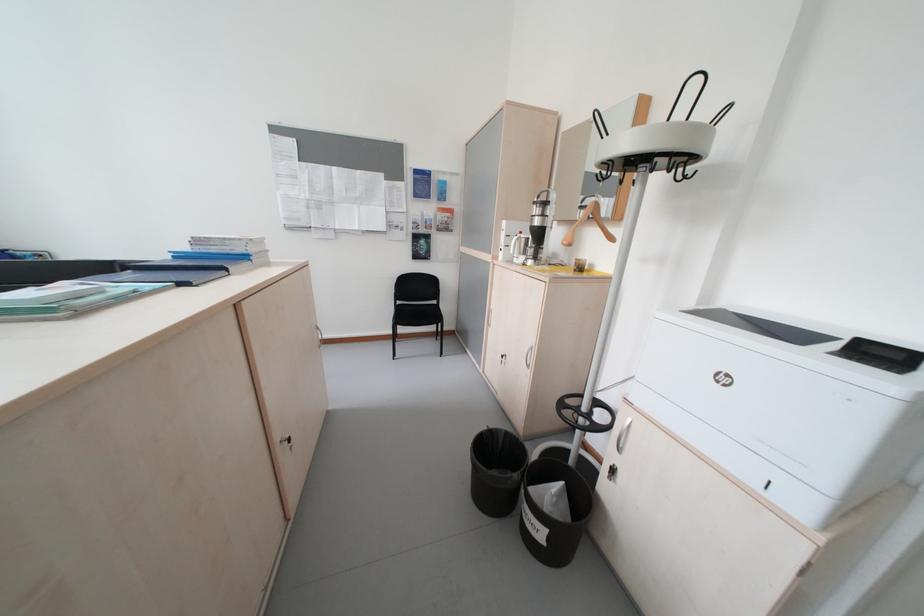
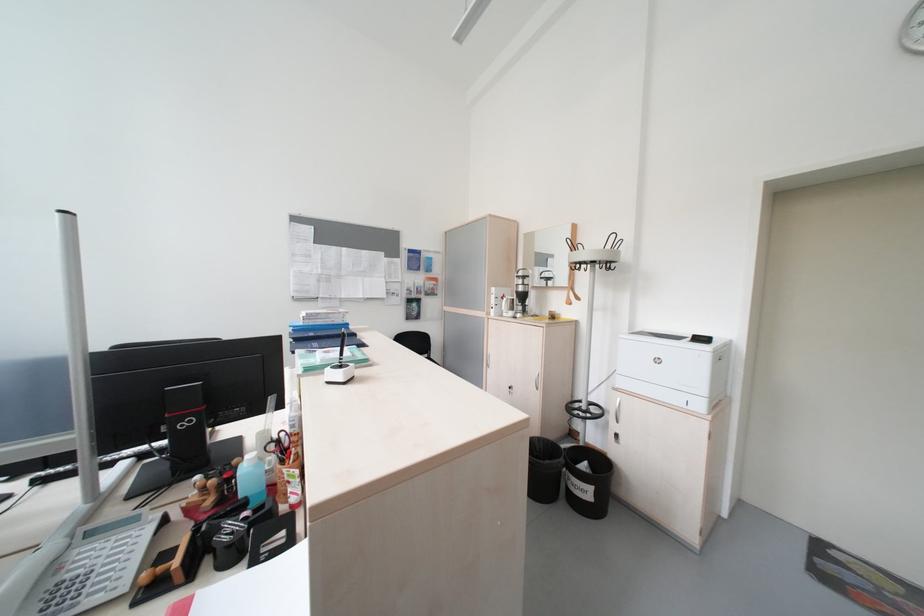
In the second image, find the point that corresponds to (505,474) in the first image.

(557, 464)